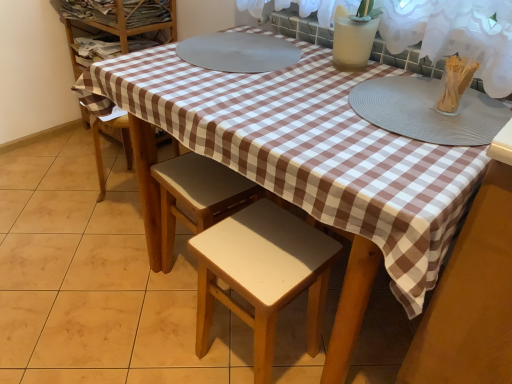
Identify the location of vacant region below white matte stool at lower center, positioned as the 2th stool in back-to-front order (from a real-world perspective). The height and width of the screenshot is (384, 512). (251, 355).